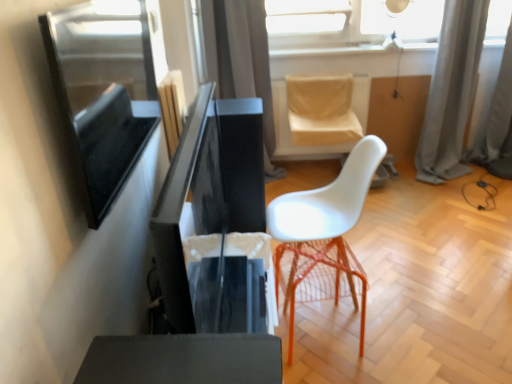
Question: Is transparent glass lampshade at upper center behind matte black screen at left?

Choices:
 (A) yes
 (B) no

Answer: (A)

Question: Can you confirm if transparent glass lampshade at upper center is positioned to the right of matte black screen at left?

Choices:
 (A) yes
 (B) no

Answer: (A)

Question: From the image's perspective, is transparent glass lampshade at upper center above matte black screen at left?

Choices:
 (A) no
 (B) yes

Answer: (B)

Question: From a real-world perspective, is transparent glass lampshade at upper center positioned over matte black screen at left based on gravity?

Choices:
 (A) no
 (B) yes

Answer: (A)

Question: Is transparent glass lampshade at upper center positioned in front of matte black screen at left?

Choices:
 (A) yes
 (B) no

Answer: (B)

Question: From the image's perspective, is satin gray curtain at upper center, which is the 1th curtain in left-to-right order, above or below white plastic chair at center?

Choices:
 (A) above
 (B) below

Answer: (A)

Question: Would you say satin gray curtain at upper center, which ranks as the third curtain in right-to-left order, is inside or outside white plastic chair at center?

Choices:
 (A) outside
 (B) inside

Answer: (A)

Question: Based on their sizes in the image, would you say satin gray curtain at upper center, which is the 1th curtain in left-to-right order, is bigger or smaller than white plastic chair at center?

Choices:
 (A) big
 (B) small

Answer: (A)

Question: Is point (245, 48) positioned closer to the camera than point (308, 296)?

Choices:
 (A) farther
 (B) closer

Answer: (A)

Question: Is matte black screen at left taller or shorter than gray fabric curtain at upper right, which is the second curtain in left-to-right order?

Choices:
 (A) tall
 (B) short

Answer: (B)

Question: From a real-world perspective, is matte black screen at left positioned above or below gray fabric curtain at upper right, which is the 2th curtain in right-to-left order?

Choices:
 (A) below
 (B) above

Answer: (B)

Question: In the image, is matte black screen at left positioned in front of or behind gray fabric curtain at upper right, which is the second curtain in left-to-right order?

Choices:
 (A) front
 (B) behind

Answer: (A)

Question: From the image's perspective, is matte black screen at left positioned above or below gray fabric curtain at upper right, which is the second curtain in left-to-right order?

Choices:
 (A) below
 (B) above

Answer: (A)

Question: Considering the positions of matte black screen at left and beige fabric swivel chair at upper center in the image, is matte black screen at left wider or thinner than beige fabric swivel chair at upper center?

Choices:
 (A) wide
 (B) thin

Answer: (B)

Question: Is matte black screen at left taller or shorter than beige fabric swivel chair at upper center?

Choices:
 (A) tall
 (B) short

Answer: (A)